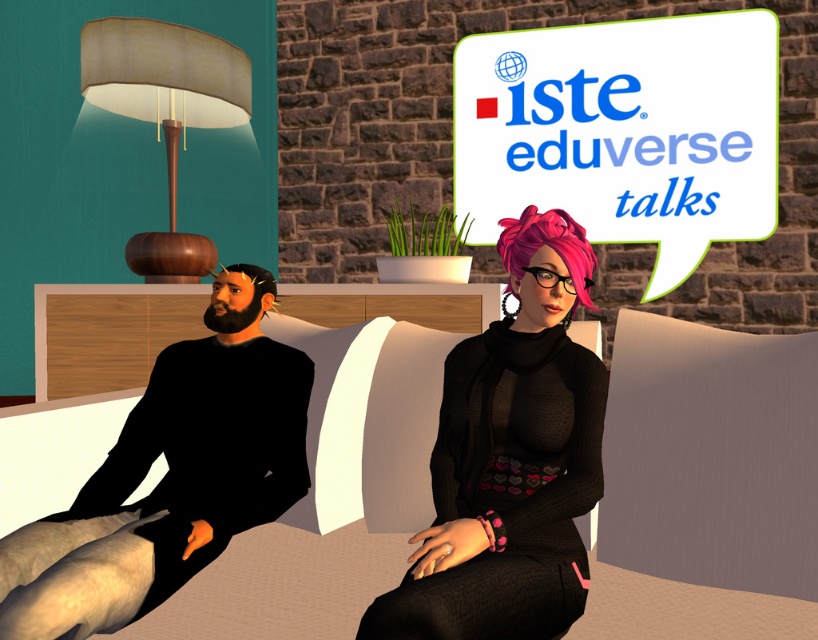
Question: Which point is closer to the camera?

Choices:
 (A) (511, 388)
 (B) (102, 36)
 (C) (55, 563)
 (D) (802, 612)

Answer: (C)

Question: Among these objects, which one is nearest to the camera?

Choices:
 (A) beige fabric couch at center
 (B) black matte clothing at left

Answer: (B)

Question: Does black matte clothing at left appear on the right side of beige fabric couch at center?

Choices:
 (A) yes
 (B) no

Answer: (B)

Question: Among these objects, which one is farthest from the camera?

Choices:
 (A) beige fabric couch at center
 (B) black matte clothing at left

Answer: (A)

Question: Is shiny pink hair at center to the right of black matte clothing at left from the viewer's perspective?

Choices:
 (A) no
 (B) yes

Answer: (B)

Question: Is shiny pink hair at center bigger than matte brown lampshade at upper left?

Choices:
 (A) no
 (B) yes

Answer: (A)